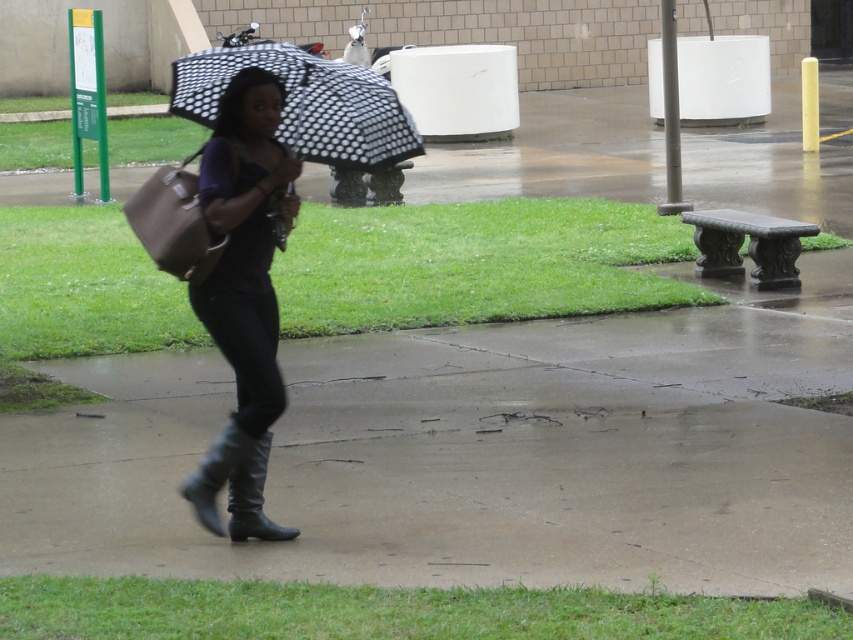
You are a photographer trying to capture a clear shot of the black leather boot at lower center. However, the polka dot fabric umbrella at center is blocking your view. Can you adjust your position to see the boot without the umbrella in the way?

The polka dot fabric umbrella at center is further to the viewer than the black leather boot at lower center, so moving your position slightly to the side or adjusting your angle might allow you to see the boot without the umbrella blocking the view.

You are a photographer standing on the sidewalk. You want to take a photo of the matte black boots at center and the polka dot fabric umbrella at center. Which object should you adjust your camera focus on first if you want to capture the one closer to you?

The matte black boots at center is to the right of polka dot fabric umbrella at center, but since the question is about distance from the photographer, the spatial description provided does not indicate which is closer. Therefore, based on the given information, it cannot be determined which object is closer to you.